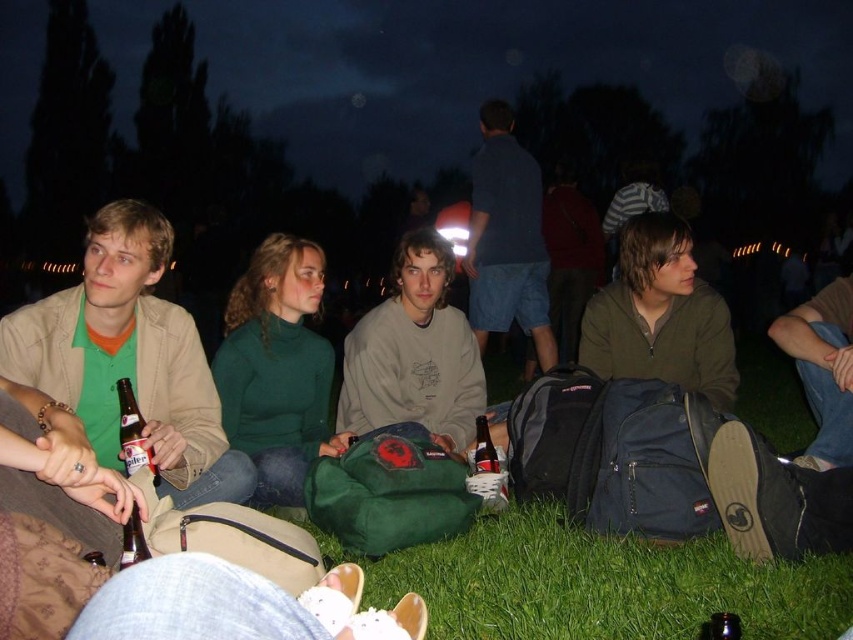
You are a photographer standing at the edge of the grassy area. You want to take a photo of the green grass at lower center and the translucent plastic bottle at lower left. Which object should you focus on first if you want to capture both in a single frame without moving your camera?

You should focus on the translucent plastic bottle at lower left first because it is above the green grass at lower center, so adjusting the focus to start with the closer object ensures both will be in the frame.

You are a photographer setting up a tripod to take a group photo of the people sitting on the green grass at lower center and the translucent plastic bottle at lower left. The tripod legs are 15 cm tall. Will the tripod legs be able to extend enough to keep the camera level with both objects?

The green grass at lower center is shorter than the translucent plastic bottle at lower left. Since the tripod legs can extend to 15 cm, they should be able to adjust to accommodate the height difference between the two objects, ensuring the camera remains level.